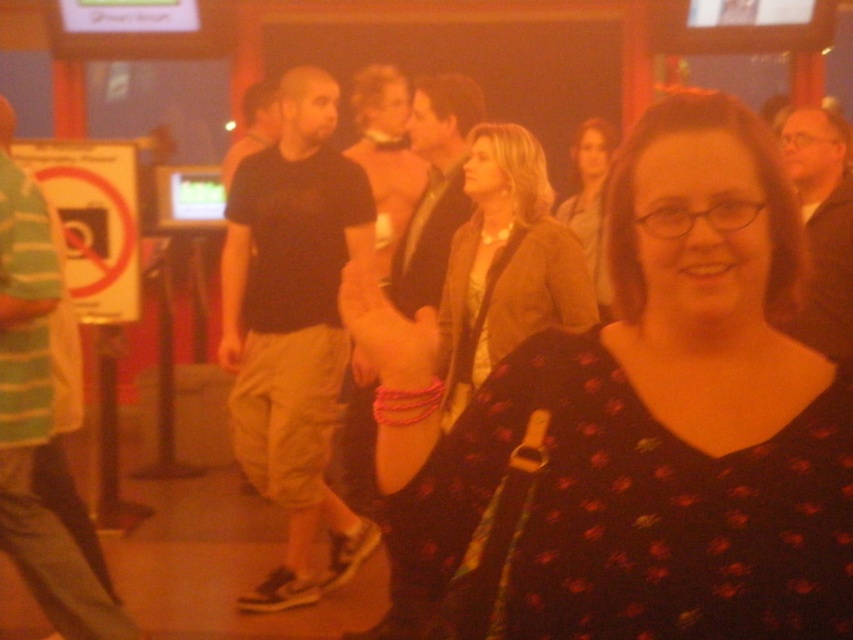
Question: Considering the relative positions of black dotted dress at center and black cotton t-shirt at center in the image provided, where is black dotted dress at center located with respect to black cotton t-shirt at center?

Choices:
 (A) below
 (B) above

Answer: (A)

Question: In this image, where is black dotted dress at center located relative to dark brown suit at right?

Choices:
 (A) below
 (B) above

Answer: (A)

Question: Which of the following is the farthest from the observer?

Choices:
 (A) dark brown suit at right
 (B) black dotted dress at center
 (C) matte brown jacket at center
 (D) black cotton t-shirt at center

Answer: (C)

Question: Observing the image, what is the correct spatial positioning of black dotted dress at center in reference to matte brown jacket at center?

Choices:
 (A) right
 (B) left

Answer: (B)

Question: Which point is closer to the camera?

Choices:
 (A) matte brown blazer at center
 (B) dark brown suit at right
 (C) matte brown jacket at center
 (D) black cotton t-shirt at center

Answer: (A)

Question: Considering the real-world distances, which object is farthest from the matte brown jacket at center?

Choices:
 (A) black dotted dress at center
 (B) dark brown suit at right

Answer: (A)